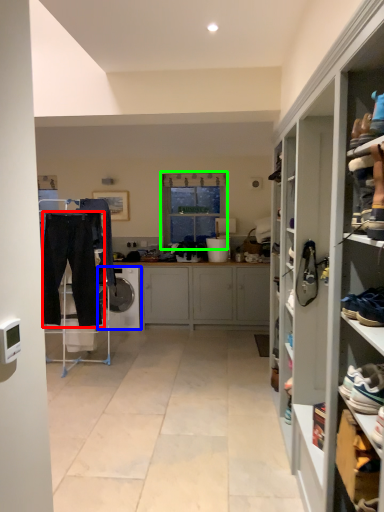
Question: Which is farther away from trousers (highlighted by a red box)? dish washer (highlighted by a blue box) or window (highlighted by a green box)?

Choices:
 (A) dish washer
 (B) window

Answer: (B)